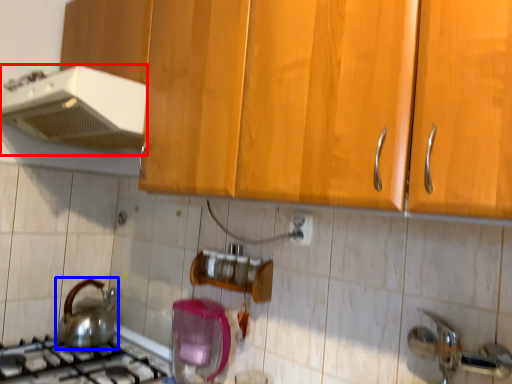
Question: Which object is closer to the camera taking this photo, kitchen appliance (highlighted by a red box) or kitchen appliance (highlighted by a blue box)?

Choices:
 (A) kitchen appliance
 (B) kitchen appliance

Answer: (A)